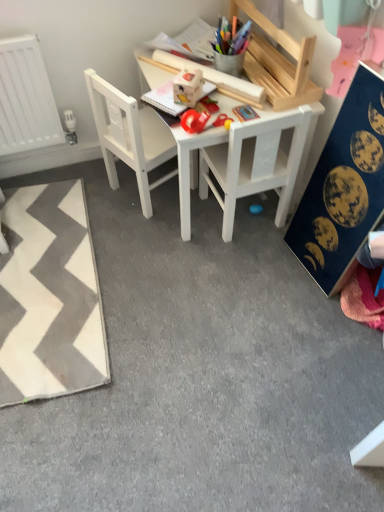
Locate an element on the screen. The width and height of the screenshot is (384, 512). vacant area that lies between dark blue fabric with celestial prints at right and white wooden table at center is located at coordinates (253, 260).